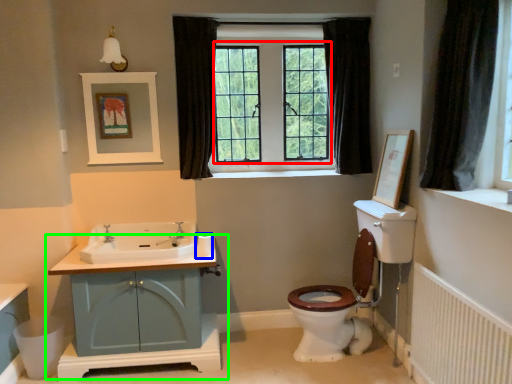
Question: Which object is positioned farthest from bay window (highlighted by a red box)? Select from toilet paper (highlighted by a blue box) and bathroom cabinet (highlighted by a green box).

Choices:
 (A) toilet paper
 (B) bathroom cabinet

Answer: (B)